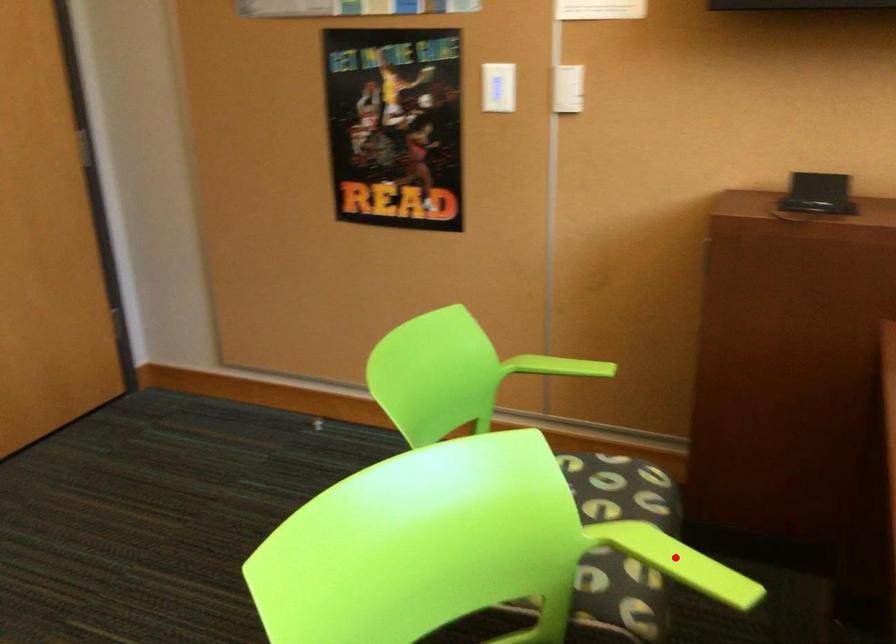
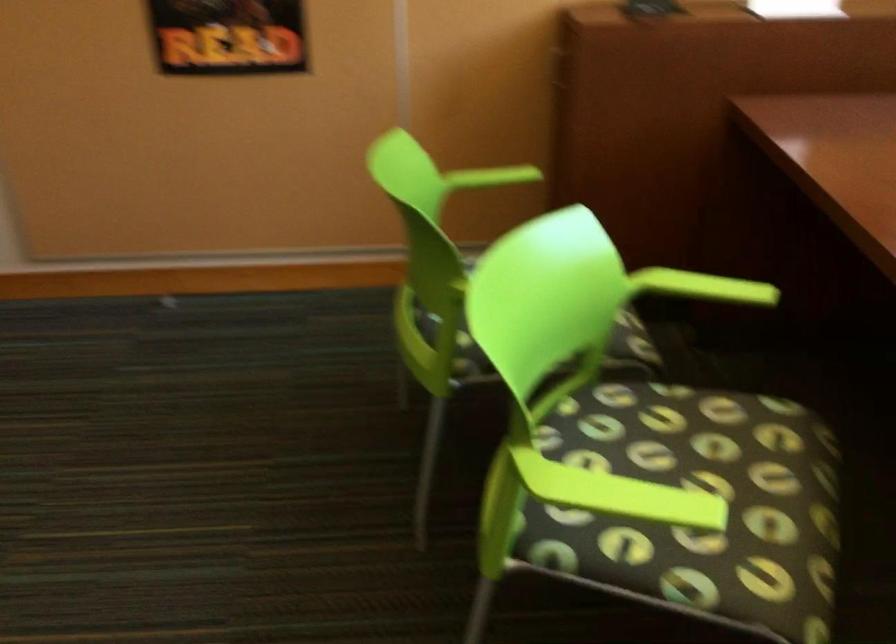
Locate, in the second image, the point that corresponds to the highlighted location in the first image.

(702, 287)